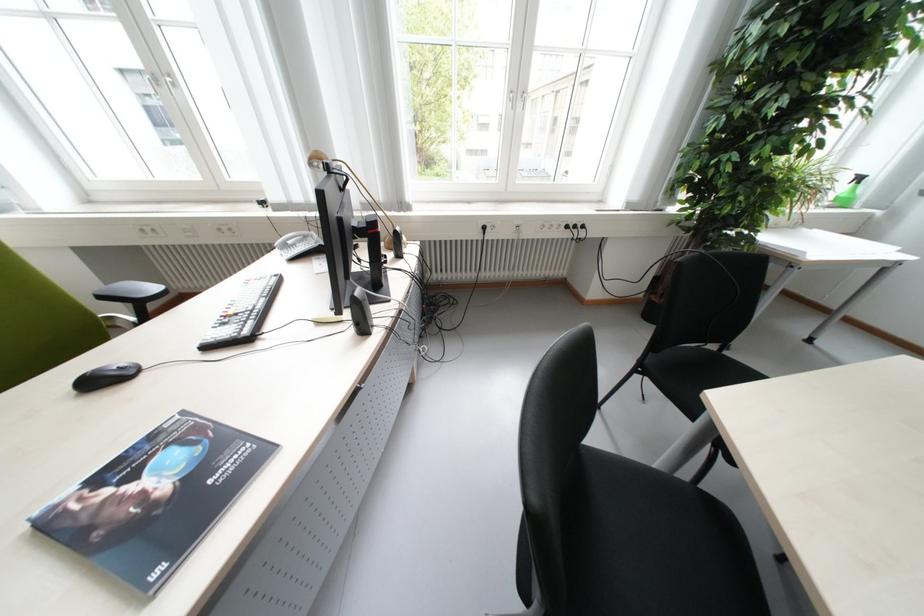
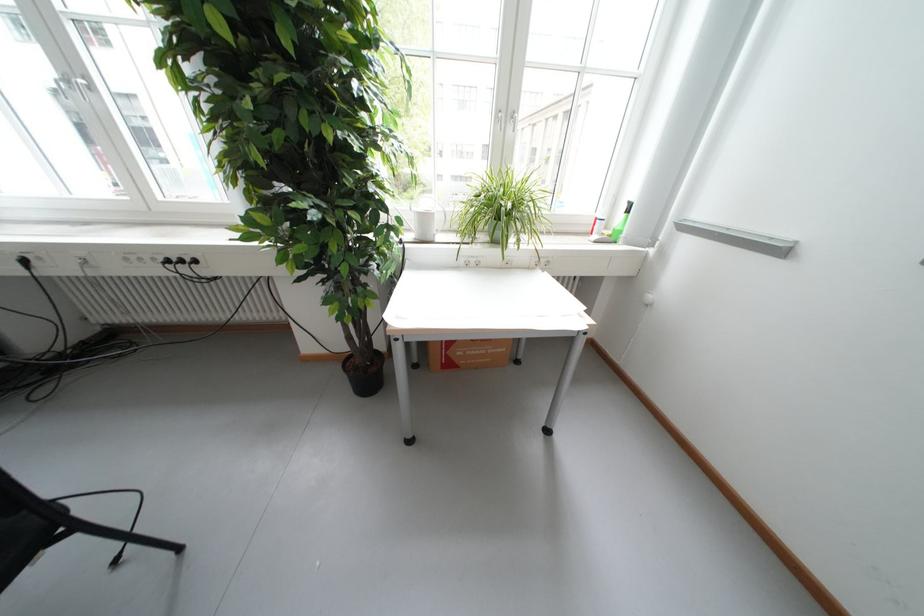
Question: The images are taken continuously from a first-person perspective. In which direction are you moving?

Choices:
 (A) Left
 (B) Right
 (C) Forward
 (D) Backward

Answer: (B)